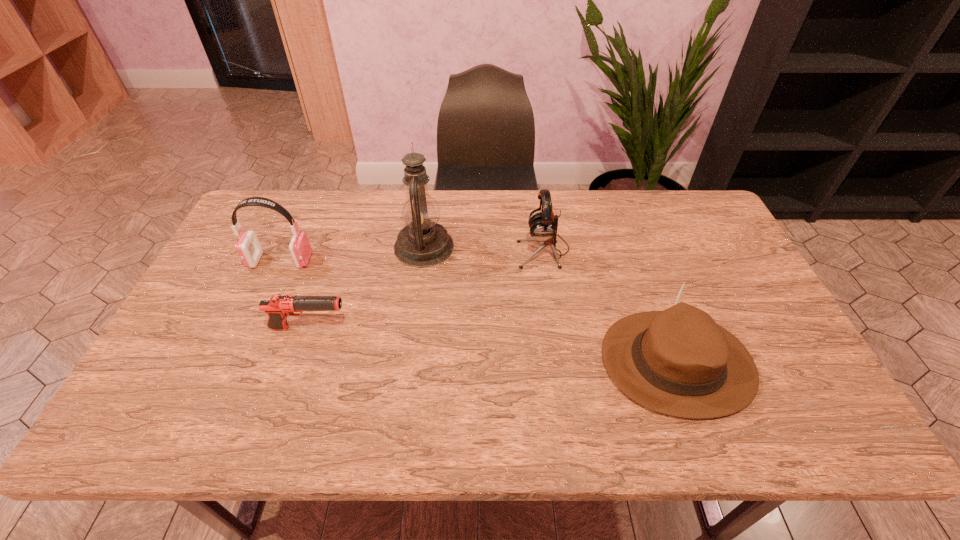
In the image, there is a desktop. Where is `free space at the far edge`? free space at the far edge is located at coordinates (569, 201).

The width and height of the screenshot is (960, 540). In the image, there is a desktop. What are the coordinates of `vacant space at the near edge` in the screenshot? It's located at (671, 442).

What are the coordinates of `blank area at the left edge` in the screenshot? It's located at (200, 402).

Identify the location of free location at the right edge. Image resolution: width=960 pixels, height=540 pixels. (730, 310).

The width and height of the screenshot is (960, 540). In the image, there is a desktop. Find the location of `vacant space at the far left corner`. vacant space at the far left corner is located at coordinates (275, 190).

Where is `vacant region at the far right corner`? This screenshot has width=960, height=540. vacant region at the far right corner is located at coordinates (676, 205).

Identify the location of blank area at the near right corner. (786, 431).

This screenshot has width=960, height=540. I want to click on free space between the left earphone and the tallest object, so click(352, 254).

At what (x,y) coordinates should I click in order to perform the action: click on empty space that is in between the left earphone and the gun. Please return your answer as a coordinate pair (x, y). The image size is (960, 540). Looking at the image, I should click on tap(295, 295).

Find the location of a particular element. blank region between the right earphone and the shortest object is located at coordinates (426, 289).